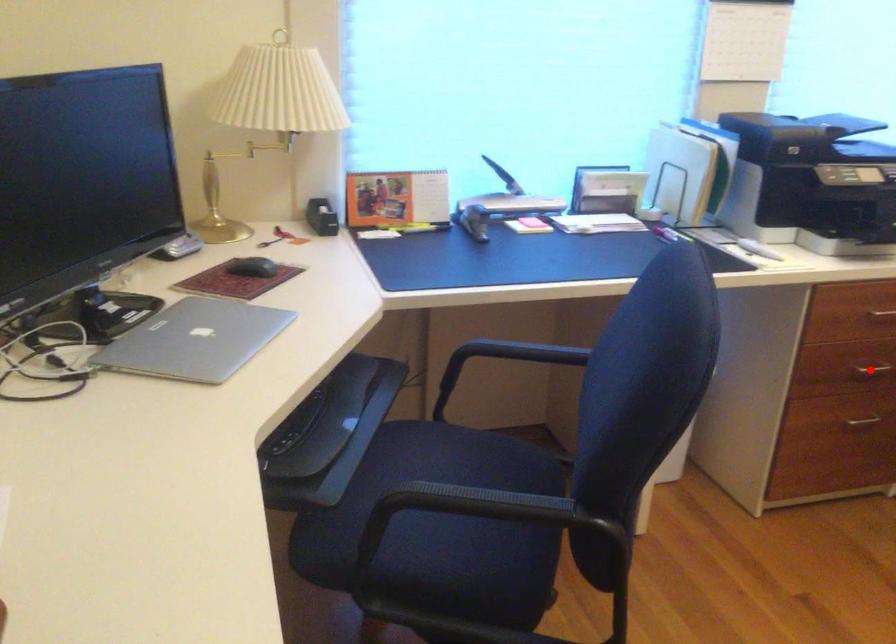
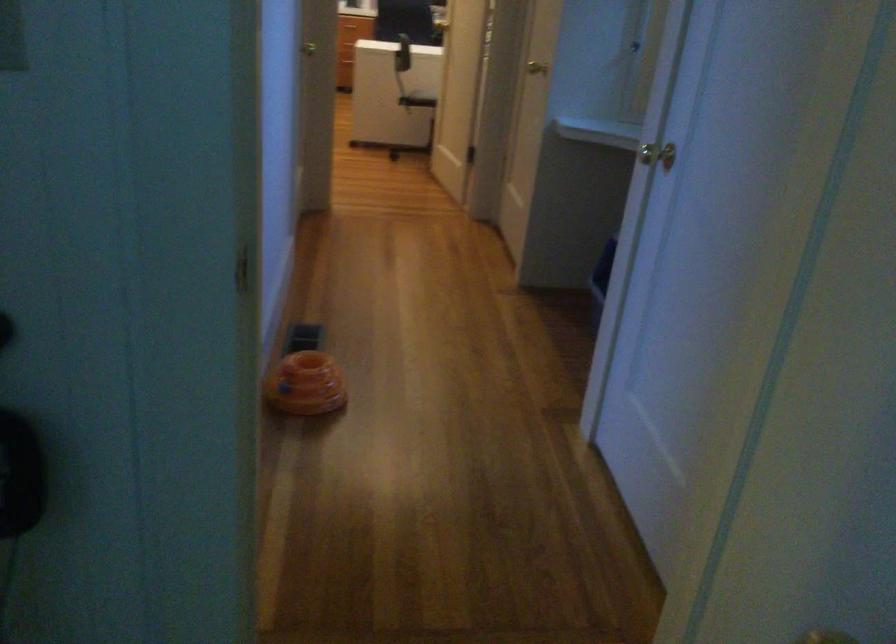
Question: I am providing you with two images of the same scene from different viewpoints. A red point is marked on the first image. Is the red point's position out of view in image 2?

Choices:
 (A) Yes
 (B) No

Answer: (A)